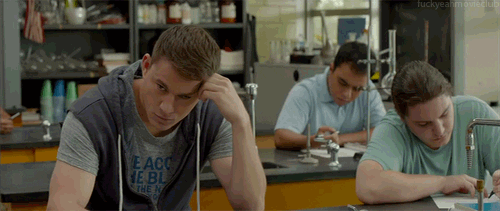
Identify the location of storage shelving. (228, 17), (113, 52), (111, 16), (249, 55).